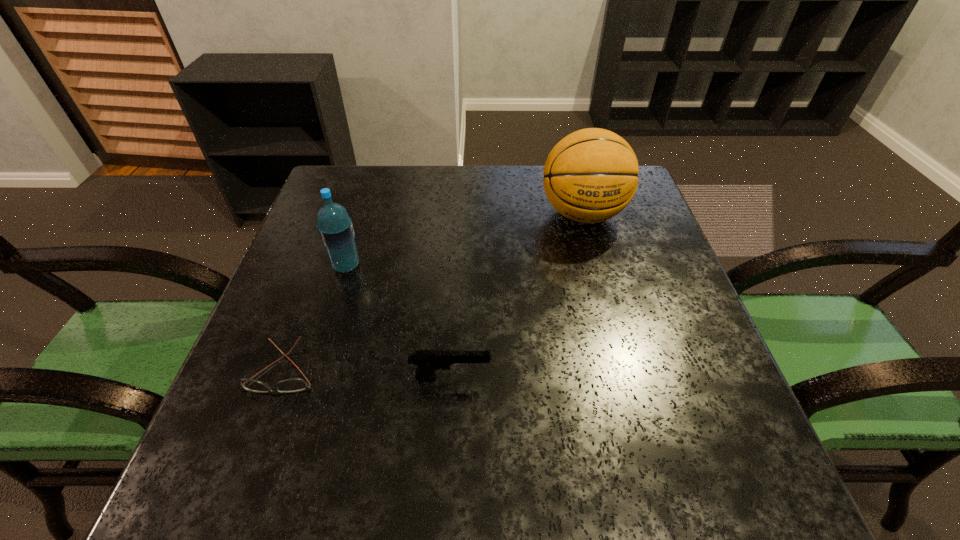
Find the location of `blank region between the second object from right to left and the spectacles`. blank region between the second object from right to left and the spectacles is located at coordinates (367, 374).

Identify which object is the second closest to the pistol. Please provide its 2D coordinates. Your answer should be formatted as a tuple, i.e. [(x, y)], where the tuple contains the x and y coordinates of a point satisfying the conditions above.

[(335, 228)]

Image resolution: width=960 pixels, height=540 pixels. What are the coordinates of `object that is the second nearest to the spectacles` in the screenshot? It's located at (335, 228).

At what (x,y) coordinates should I click in order to perform the action: click on free space that satisfies the following two spatial constraints: 1. on the surface of the farthest object near the brand logo; 2. on the front-facing side of the third object from left to right. Please return your answer as a coordinate pair (x, y). This screenshot has height=540, width=960. Looking at the image, I should click on (627, 377).

Where is `vacant position in the image that satisfies the following two spatial constraints: 1. on the surface of the farthest object near the brand logo; 2. on the front-facing side of the second shortest object`? vacant position in the image that satisfies the following two spatial constraints: 1. on the surface of the farthest object near the brand logo; 2. on the front-facing side of the second shortest object is located at coordinates (627, 377).

Locate an element on the screen. free location that satisfies the following two spatial constraints: 1. on the surface of the farthest object near the brand logo; 2. on the front-facing side of the second object from right to left is located at coordinates (627, 377).